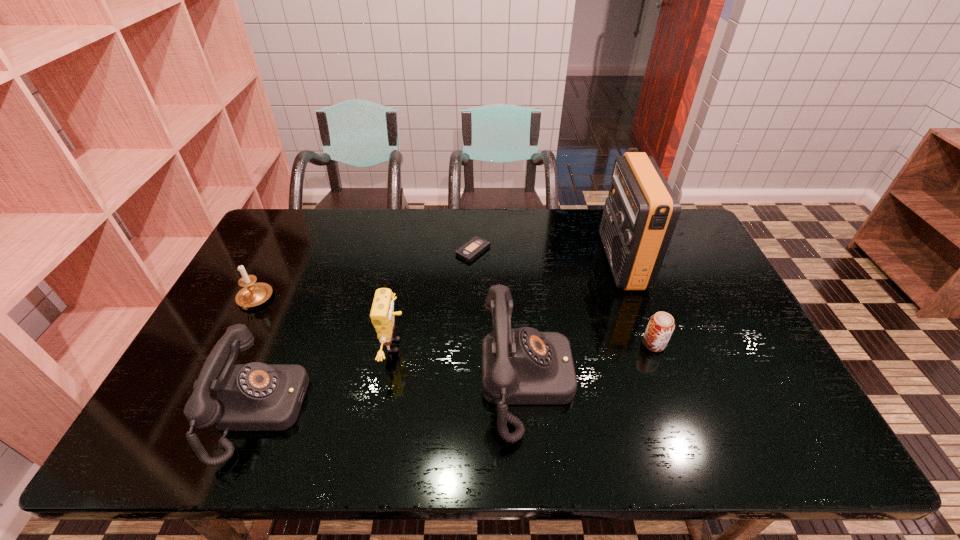
Where is `vacant space situated 0.330m on the dial of the right telephone`? The width and height of the screenshot is (960, 540). vacant space situated 0.330m on the dial of the right telephone is located at coordinates pyautogui.click(x=705, y=381).

Locate an element on the screen. vacant region located on the front of the shortest object is located at coordinates (472, 286).

What are the coordinates of `vacant area situated 0.140m on the front-facing side of the radio receiver` in the screenshot? It's located at (562, 262).

At what (x,y) coordinates should I click in order to perform the action: click on free space located 0.250m on the front-facing side of the radio receiver. Please return your answer as a coordinate pair (x, y). The image size is (960, 540). Looking at the image, I should click on (528, 262).

Locate an element on the screen. This screenshot has width=960, height=540. vacant space situated on the front-facing side of the radio receiver is located at coordinates (577, 262).

Identify the location of vacant space located with a handle on the side of the fifth tallest object. (233, 340).

This screenshot has width=960, height=540. Identify the location of free space located on the face of the sponge. (548, 346).

The height and width of the screenshot is (540, 960). In order to click on vacant space located on the front of the beer can in this screenshot , I will do 668,382.

What are the coordinates of `videotape that is positioned at the far edge` in the screenshot? It's located at (473, 248).

Where is `radio receiver that is positioned at the far edge`? radio receiver that is positioned at the far edge is located at coordinates (641, 211).